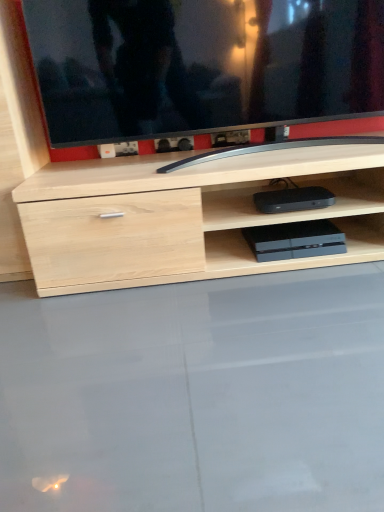
Question: Is transparent glass table at lower center facing away from slate gray plastic game console at lower center, which is counted as the first equipment, starting from the bottom?

Choices:
 (A) no
 (B) yes

Answer: (A)

Question: From a real-world perspective, does transparent glass table at lower center sit lower than slate gray plastic game console at lower center, the second equipment when ordered from top to bottom?

Choices:
 (A) no
 (B) yes

Answer: (B)

Question: Can you confirm if transparent glass table at lower center is positioned to the right of slate gray plastic game console at lower center, which is counted as the first equipment, starting from the bottom?

Choices:
 (A) yes
 (B) no

Answer: (B)

Question: Is transparent glass table at lower center aimed at slate gray plastic game console at lower center, which is counted as the first equipment, starting from the bottom?

Choices:
 (A) yes
 (B) no

Answer: (B)

Question: From a real-world perspective, is transparent glass table at lower center on slate gray plastic game console at lower center, the second equipment when ordered from top to bottom?

Choices:
 (A) no
 (B) yes

Answer: (A)

Question: Does transparent glass table at lower center come in front of slate gray plastic game console at lower center, the second equipment when ordered from top to bottom?

Choices:
 (A) yes
 (B) no

Answer: (A)

Question: Does transparent glass table at lower center have a greater width compared to black plastic device at center, placed as the first equipment when sorted from top to bottom?

Choices:
 (A) no
 (B) yes

Answer: (B)

Question: From a real-world perspective, does transparent glass table at lower center sit lower than black plastic device at center, the 2th equipment when ordered from bottom to top?

Choices:
 (A) yes
 (B) no

Answer: (A)

Question: From the image's perspective, does transparent glass table at lower center appear higher than black plastic device at center, placed as the first equipment when sorted from top to bottom?

Choices:
 (A) yes
 (B) no

Answer: (B)

Question: Is transparent glass table at lower center outside black plastic device at center, placed as the first equipment when sorted from top to bottom?

Choices:
 (A) no
 (B) yes

Answer: (B)

Question: From the image's perspective, is transparent glass table at lower center located beneath black plastic device at center, the 2th equipment when ordered from bottom to top?

Choices:
 (A) yes
 (B) no

Answer: (A)

Question: Can you confirm if transparent glass table at lower center is positioned to the right of black plastic device at center, placed as the first equipment when sorted from top to bottom?

Choices:
 (A) yes
 (B) no

Answer: (B)

Question: From a real-world perspective, is black glossy tv at upper center on black plastic device at center, the 2th equipment when ordered from bottom to top?

Choices:
 (A) yes
 (B) no

Answer: (A)